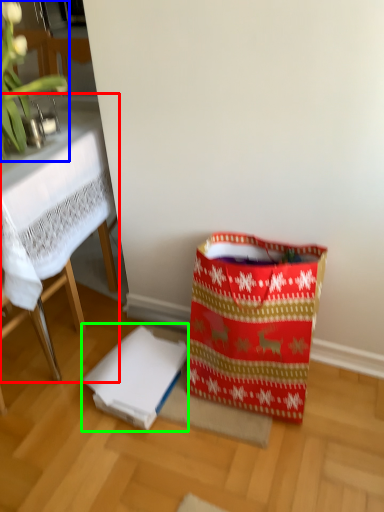
Question: Which is farther away from table (highlighted by a red box)? orchid (highlighted by a blue box) or cardboard box (highlighted by a green box)?

Choices:
 (A) orchid
 (B) cardboard box

Answer: (B)